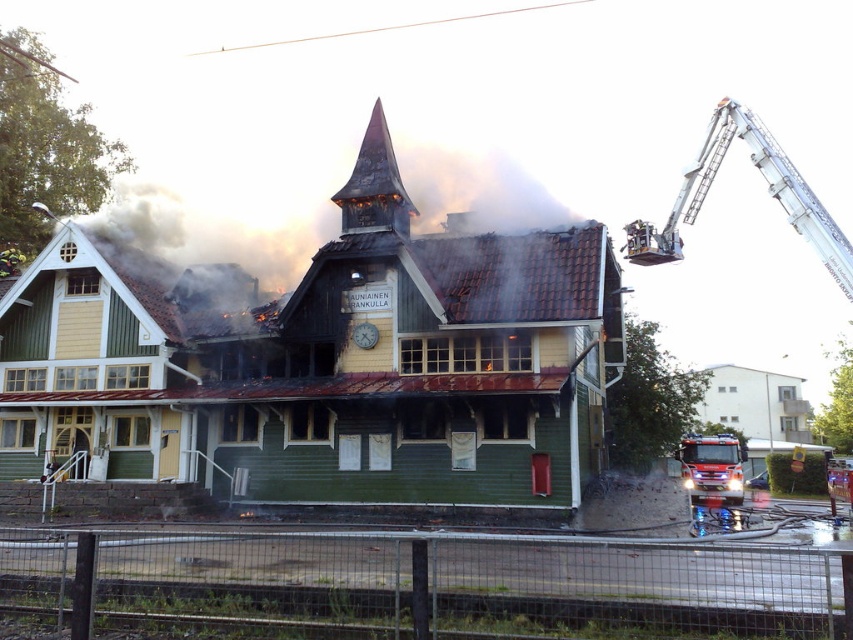
Question: Is charred wood spire at center above shiny metallic fire truck at lower right?

Choices:
 (A) no
 (B) yes

Answer: (B)

Question: Based on their relative distances, which object is farther from the charred wood spire at center?

Choices:
 (A) silver metallic crane at upper right
 (B) shiny metallic fire truck at lower right

Answer: (A)

Question: Which point is closer to the camera?

Choices:
 (A) shiny metallic fire truck at lower right
 (B) silver metallic crane at upper right

Answer: (A)

Question: Does silver metallic crane at upper right appear on the right side of charred wood spire at center?

Choices:
 (A) no
 (B) yes

Answer: (B)

Question: Does silver metallic crane at upper right come behind charred wood spire at center?

Choices:
 (A) no
 (B) yes

Answer: (B)

Question: Which is farther from the shiny metallic fire truck at lower right?

Choices:
 (A) charred wood spire at center
 (B) silver metallic crane at upper right

Answer: (A)